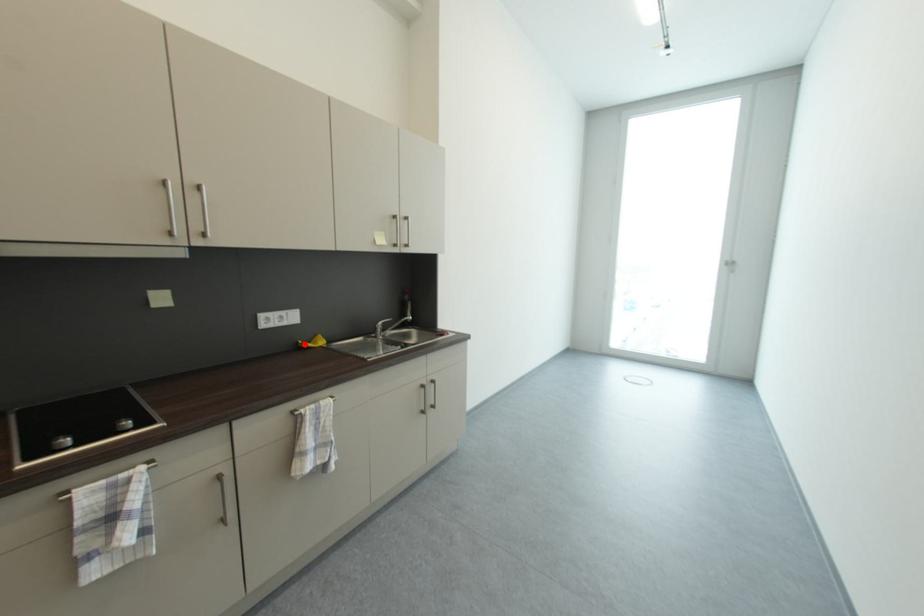
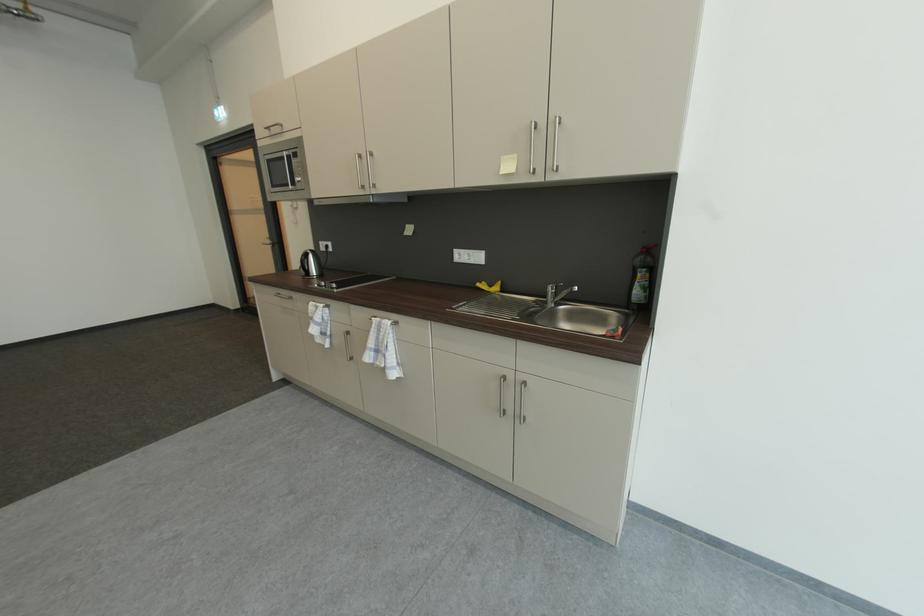
The point at the highlighted location is marked in the first image. Where is the corresponding point in the second image?

(487, 284)